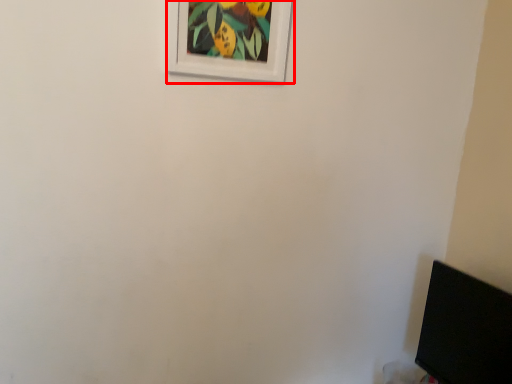
Question: From the image, what is the correct spatial relationship of picture frame (annotated by the red box) in relation to computer monitor?

Choices:
 (A) right
 (B) left

Answer: (B)